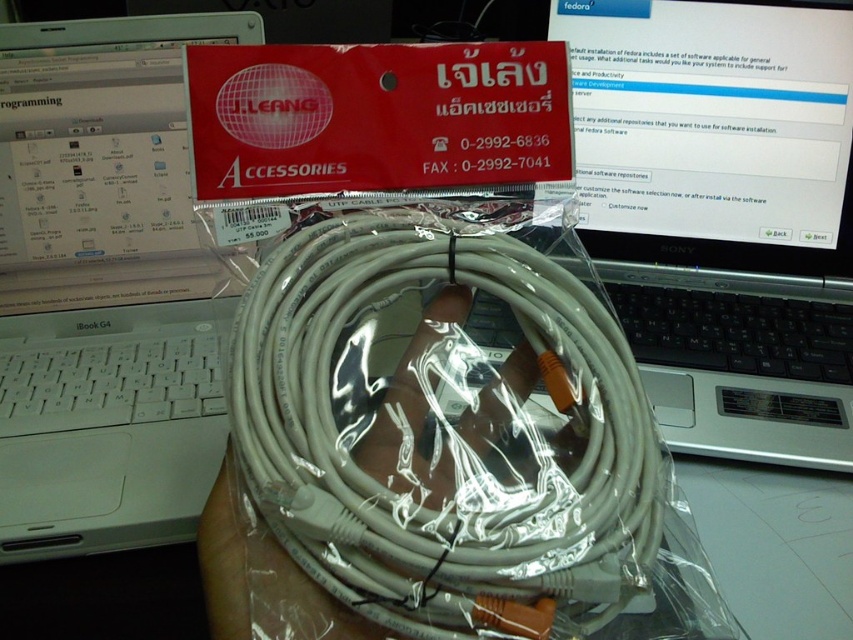
Does white plastic cable at center appear over silver metallic laptop at upper right?

Incorrect, white plastic cable at center is not positioned above silver metallic laptop at upper right.

Can you confirm if white plastic cable at center is taller than silver metallic laptop at upper right?

Incorrect, white plastic cable at center's height is not larger of silver metallic laptop at upper right's.

You are a GUI agent. You are given a task and a screenshot of the screen. Output one action in this format:
    pyautogui.click(x=<x>, y=<y>)
    Task: Click on the white plastic cable at center
    The height and width of the screenshot is (640, 853).
    Given the screenshot: What is the action you would take?
    pyautogui.click(x=442, y=428)

Can you confirm if white plastic cable at center is positioned to the left of white plastic laptop at center?

No, white plastic cable at center is not to the left of white plastic laptop at center.

Between point (361, 611) and point (45, 524), which one is positioned behind?

The point (45, 524) is more distant.

Who is more forward, (538, 596) or (39, 476)?

Point (538, 596) is in front.

Where is `white plastic cable at center`? white plastic cable at center is located at coordinates (442, 428).

Does silver metallic laptop at upper right appear on the right side of white plastic laptop at center?

Yes, silver metallic laptop at upper right is to the right of white plastic laptop at center.

The width and height of the screenshot is (853, 640). In order to click on silver metallic laptop at upper right in this screenshot , I will do click(723, 211).

Is point (645, 195) closer to camera compared to point (219, 385)?

No, (645, 195) is further to viewer.

This screenshot has width=853, height=640. Identify the location of silver metallic laptop at upper right. (723, 211).